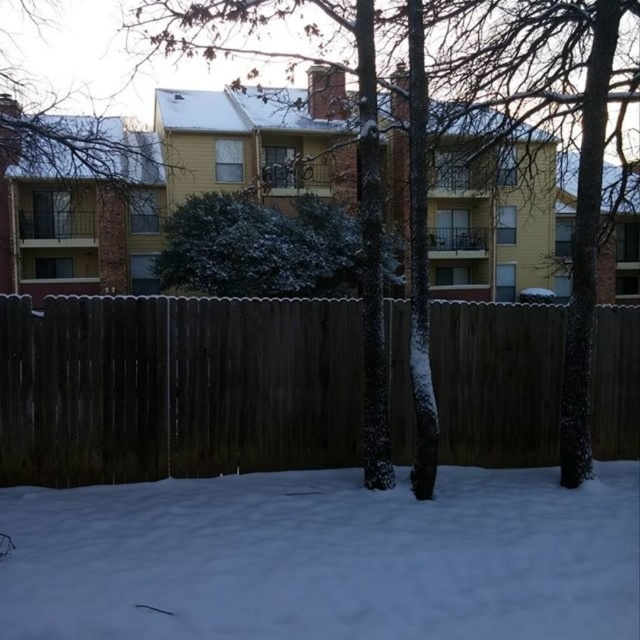
Can you confirm if white fluffy snow at lower center is taller than green textured bush at center?

No.

Can you confirm if white fluffy snow at lower center is positioned above green textured bush at center?

Incorrect, white fluffy snow at lower center is not positioned above green textured bush at center.

Which is behind, point (538, 582) or point (323, 200)?

The point (323, 200) is more distant.

Where is `white fluffy snow at lower center`? The width and height of the screenshot is (640, 640). white fluffy snow at lower center is located at coordinates (324, 557).

Which is more to the right, green textured bush at center or smooth bark tree at upper center?

green textured bush at center

Does point (353, 291) lie behind point (92, 3)?

No, it is in front of (92, 3).

Is point (301, 262) more distant than point (97, 52)?

No, (301, 262) is closer to viewer.

Find the location of a particular element. green textured bush at center is located at coordinates (260, 248).

Is white fluffy snow at lower center smaller than dark brown wood fence at center?

Correct, white fluffy snow at lower center occupies less space than dark brown wood fence at center.

Can you confirm if white fluffy snow at lower center is positioned to the left of dark brown wood fence at center?

Incorrect, white fluffy snow at lower center is not on the left side of dark brown wood fence at center.

Who is more forward, (90, 573) or (289, 349)?

Point (90, 573)

The width and height of the screenshot is (640, 640). I want to click on white fluffy snow at lower center, so click(324, 557).